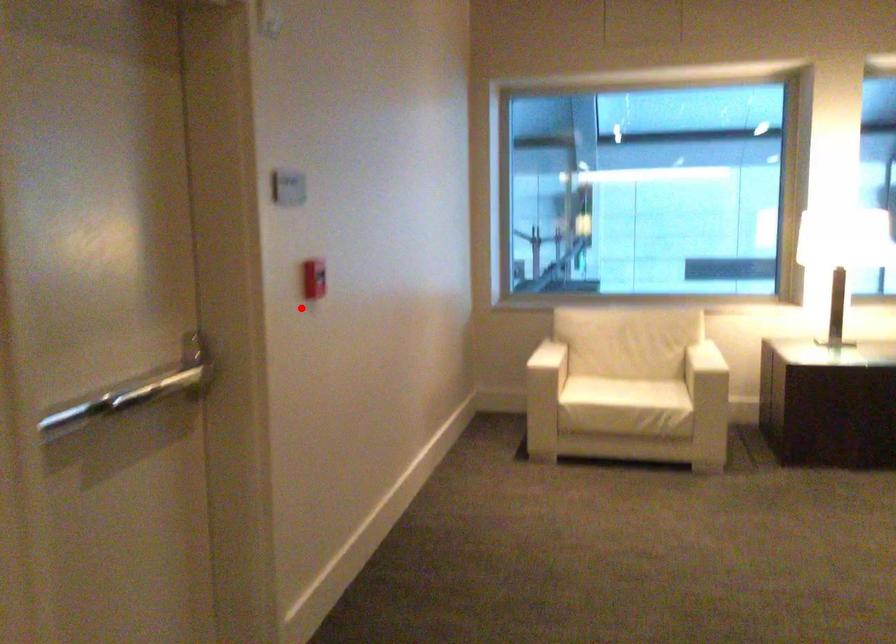
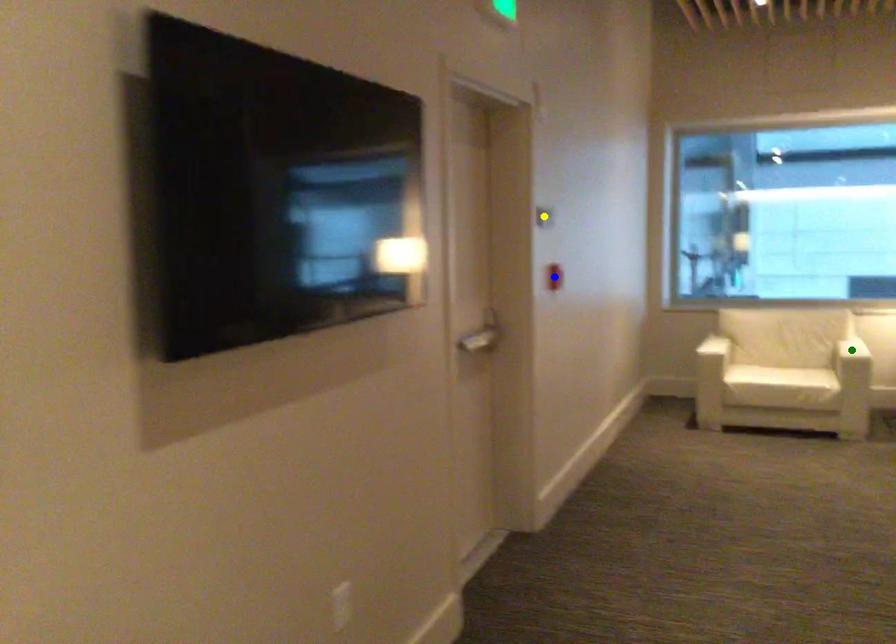
Question: I am providing you with two images of the same scene from different viewpoints. A red point is marked on the first image. You are given multiple points on the second image. Which point in image 2 represents the same 3d spot as the red point in image 1?

Choices:
 (A) blue point
 (B) green point
 (C) yellow point

Answer: (A)